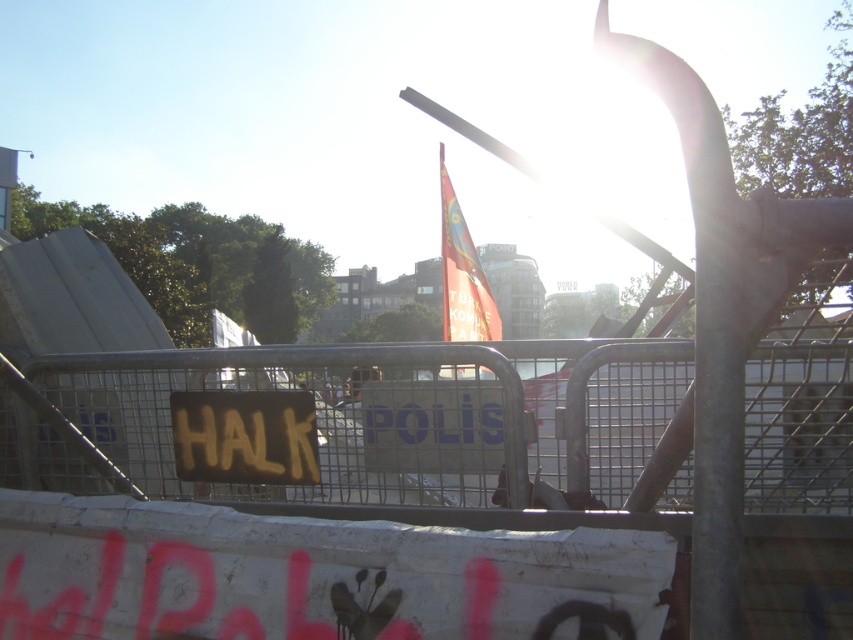
Does metallic silver fence at center have a greater height compared to yellow painted sign at center?

Yes, metallic silver fence at center is taller than yellow painted sign at center.

Who is lower down, metallic silver fence at center or yellow painted sign at center?

yellow painted sign at center

Does point (815, 401) come in front of point (245, 464)?

No, it is not.

Find the location of a particular element. Image resolution: width=853 pixels, height=640 pixels. metallic silver fence at center is located at coordinates (392, 413).

Does yellow painted sign at center have a lesser width compared to red fabric flag at center?

No.

Can you confirm if yellow painted sign at center is taller than red fabric flag at center?

In fact, yellow painted sign at center may be shorter than red fabric flag at center.

What do you see at coordinates (245, 436) in the screenshot? Image resolution: width=853 pixels, height=640 pixels. I see `yellow painted sign at center` at bounding box center [245, 436].

You are a GUI agent. You are given a task and a screenshot of the screen. Output one action in this format:
    pyautogui.click(x=<x>, y=<y>)
    Task: Click on the yellow painted sign at center
    The height and width of the screenshot is (640, 853).
    Given the screenshot: What is the action you would take?
    pyautogui.click(x=245, y=436)

Which is in front, point (590, 426) or point (456, 248)?

Point (590, 426) is in front.

Where is `metallic silver fence at center`? The height and width of the screenshot is (640, 853). metallic silver fence at center is located at coordinates (392, 413).